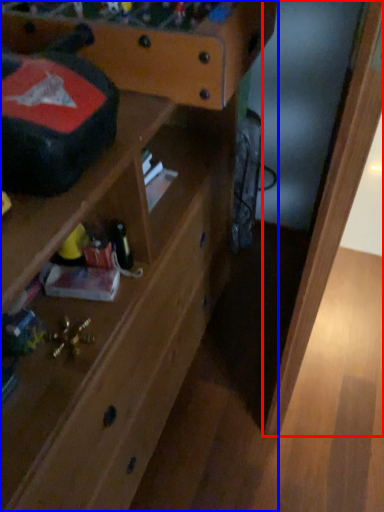
Question: Which point is closer to the camera, wood (highlighted by a red box) or shelf (highlighted by a blue box)?

Choices:
 (A) wood
 (B) shelf

Answer: (B)